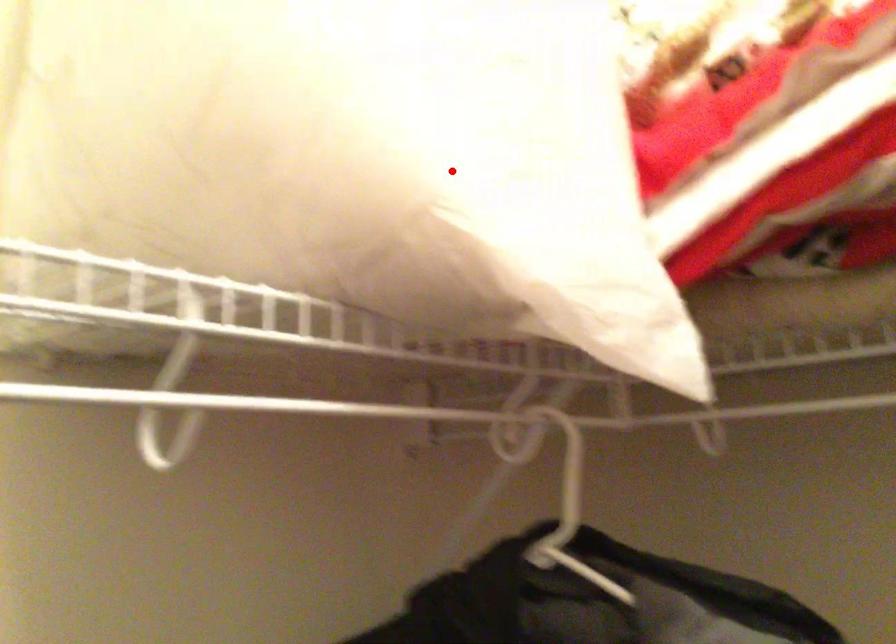
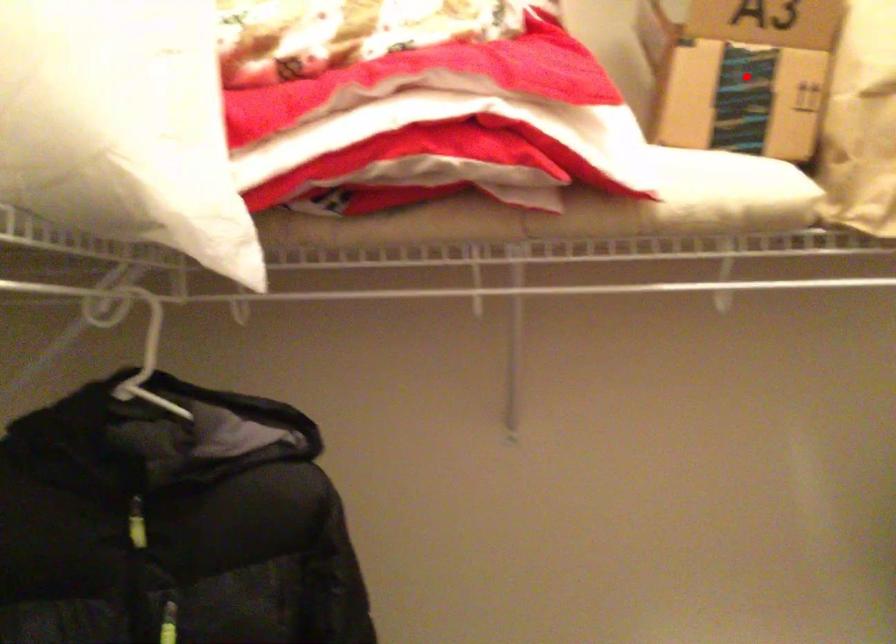
I am providing you with two images of the same scene from different viewpoints. A red point is marked on the first image and another point is marked on the second image. Is the marked point in image1 the same physical position as the marked point in image2?

No